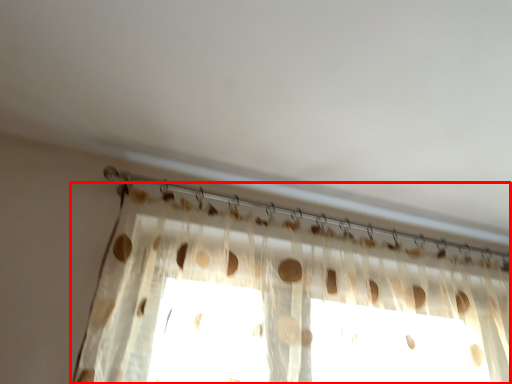
Question: From the image's perspective, what is the correct spatial relationship of curtain (annotated by the red box) in relation to clothesline?

Choices:
 (A) above
 (B) below

Answer: (B)